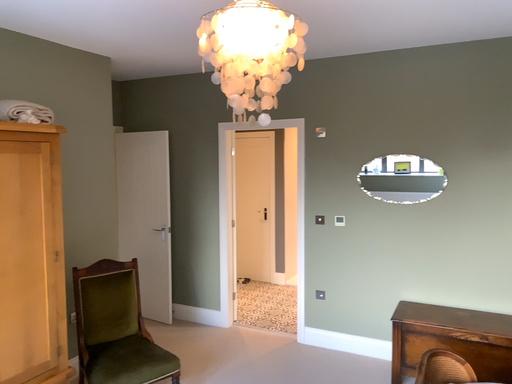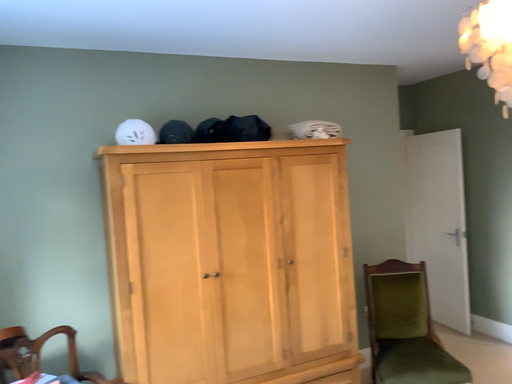
Question: Which way did the camera rotate in the video?

Choices:
 (A) rotated left
 (B) rotated right

Answer: (A)